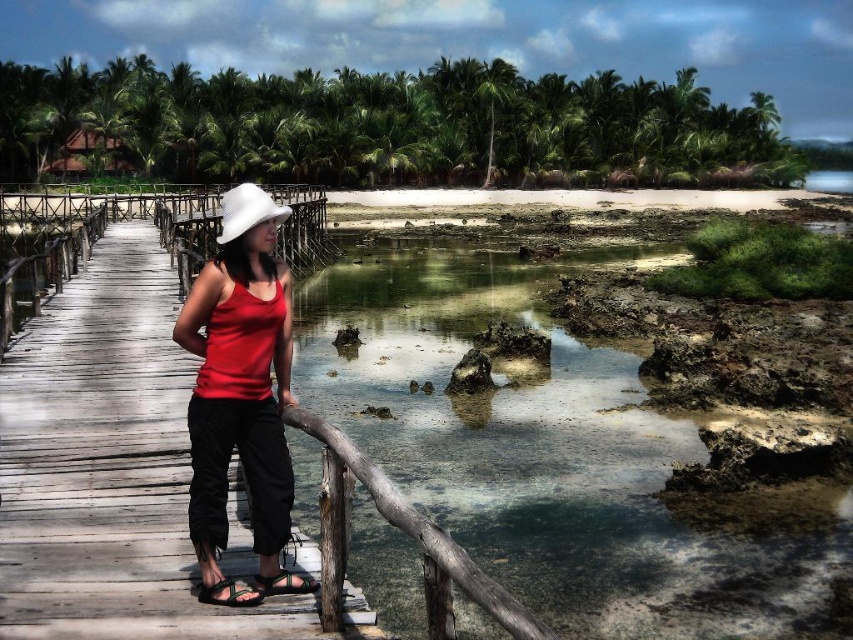
You are a fashion designer observing the tropical scene. You need to create a new outfit that matches the environment. Considering the existing items, which item has a smaller width between the matte red tank top at center and the white felt hat at center?

The matte red tank top at center has a smaller width than the white felt hat at center.

You are standing at the edge of the lagoon and see the point marked at coordinates (241,380). What object is located at that point?

The point at coordinates (241,380) corresponds to the matte red tank top at center.